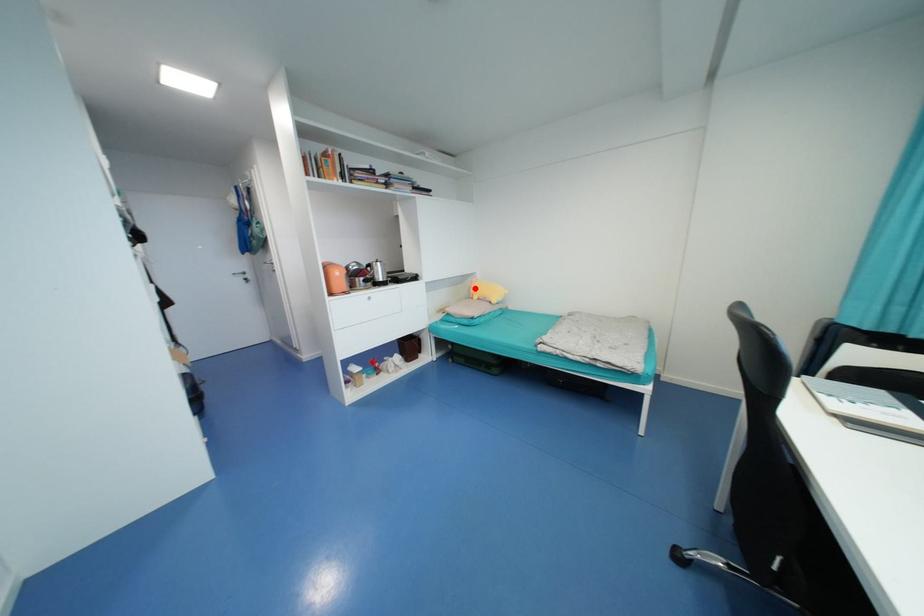
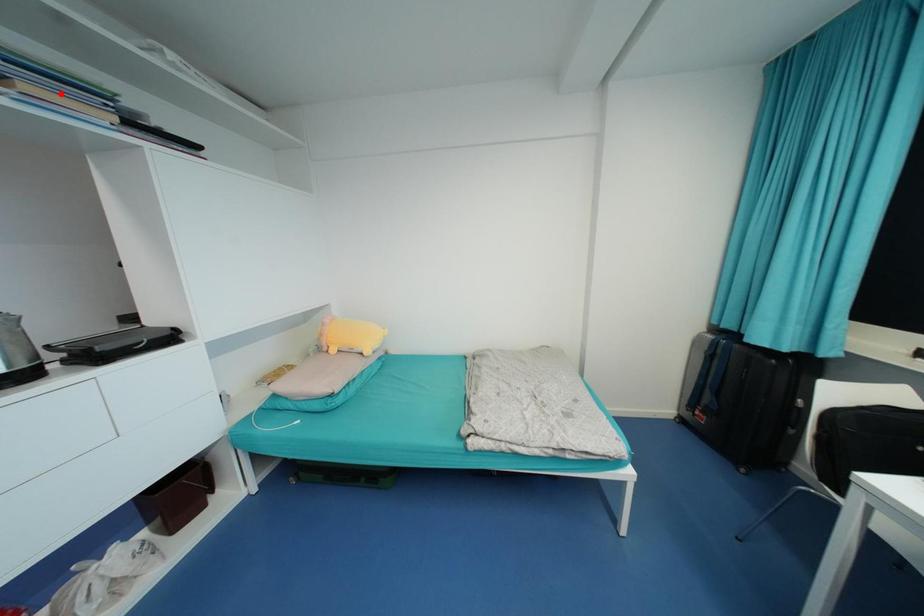
I am providing you with two images of the same scene from different viewpoints. A red point is marked on the first image and another point is marked on the second image. Does the point marked in image1 correspond to the same location as the one in image2?

No